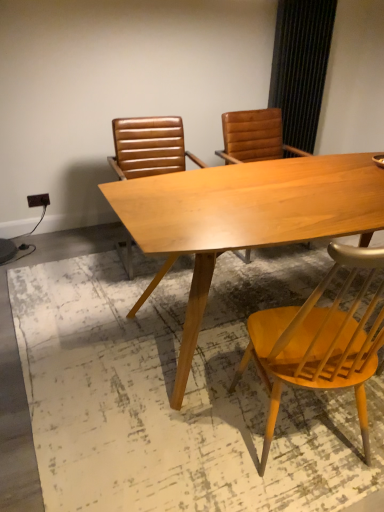
You are a GUI agent. You are given a task and a screenshot of the screen. Output one action in this format:
    pyautogui.click(x=<x>, y=<y>)
    Task: Click on the free space to the left of leather-like brown chair at center, the 1th chair from the left
    Image resolution: width=384 pixels, height=512 pixels.
    Given the screenshot: What is the action you would take?
    pyautogui.click(x=82, y=271)